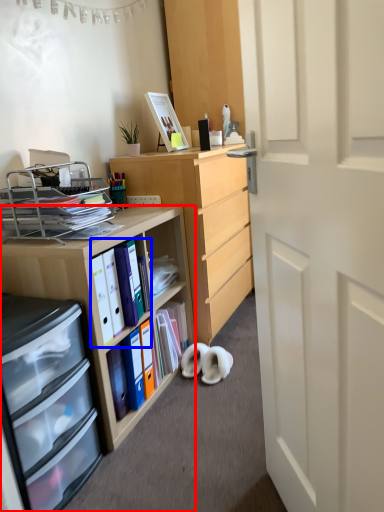
Question: Which point is further to the camera, desk (highlighted by a red box) or book (highlighted by a blue box)?

Choices:
 (A) desk
 (B) book

Answer: (B)